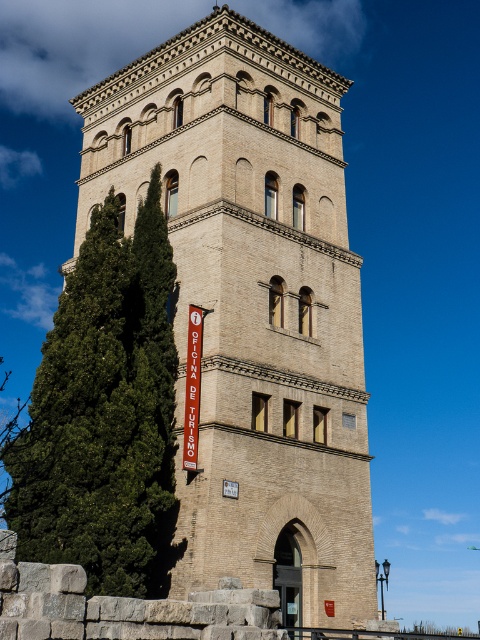
Question: Which point is closer to the camera?

Choices:
 (A) beige stone tower at center
 (B) green leafy tree at left

Answer: (B)

Question: Does beige stone tower at center appear over green leafy tree at left?

Choices:
 (A) yes
 (B) no

Answer: (A)

Question: Which of the following is the farthest from the observer?

Choices:
 (A) beige stone tower at center
 (B) green leafy tree at left

Answer: (A)

Question: Can you confirm if beige stone tower at center is positioned below green leafy tree at left?

Choices:
 (A) yes
 (B) no

Answer: (B)

Question: Where is beige stone tower at center located in relation to green leafy tree at left in the image?

Choices:
 (A) right
 (B) left

Answer: (A)